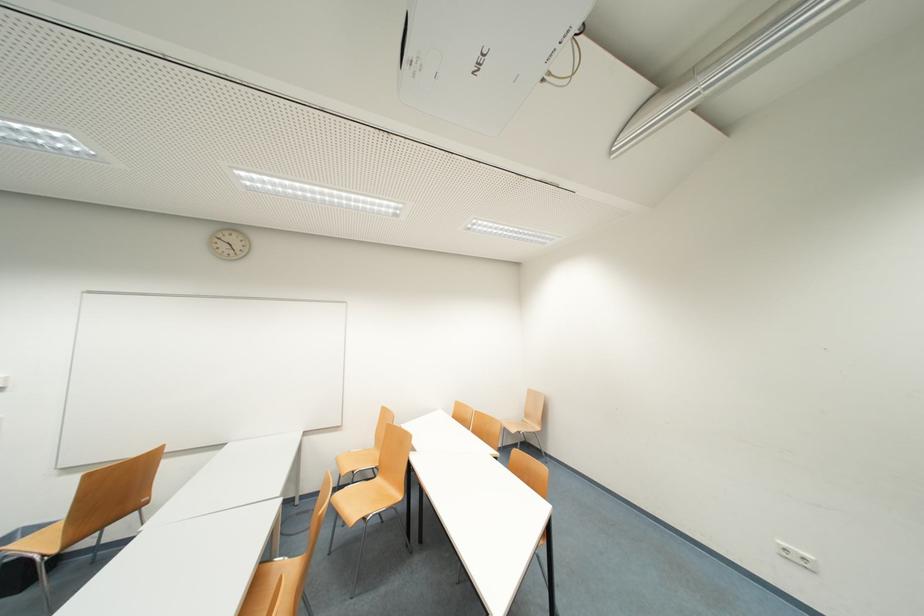
Describe the element at coordinates (796, 556) in the screenshot. I see `the white electrical socket` at that location.